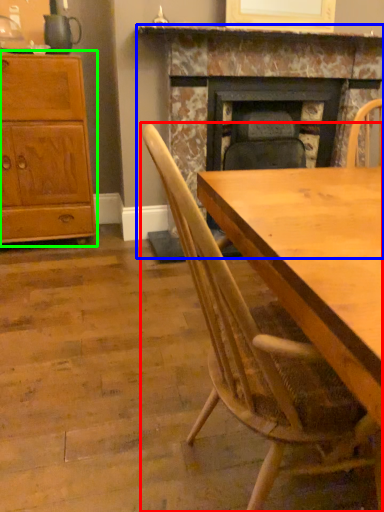
Question: Which object is positioned closest to chair (highlighted by a red box)? Select from fireplace (highlighted by a blue box) and cabinetry (highlighted by a green box).

Choices:
 (A) fireplace
 (B) cabinetry

Answer: (A)